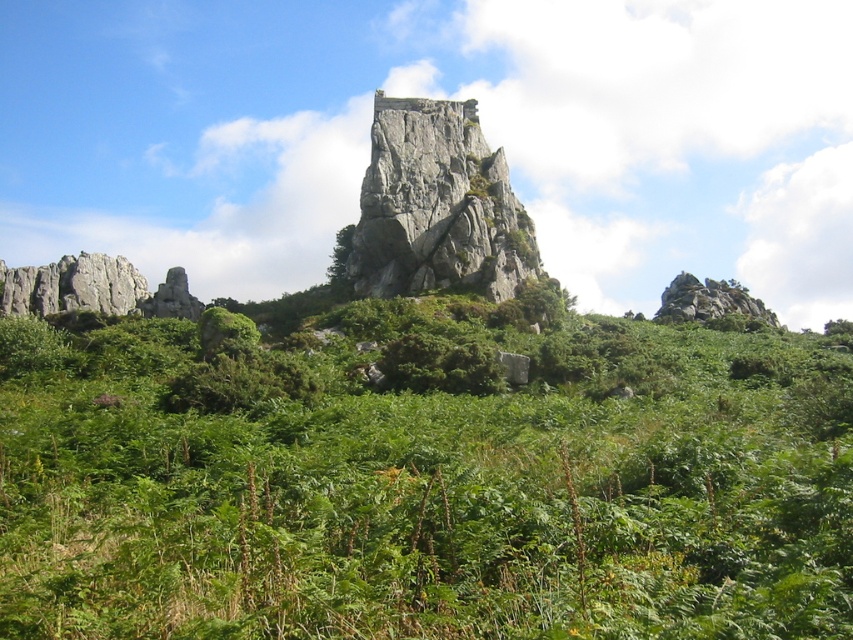
You are standing in the rugged landscape looking at the rock formation. There are two points marked on the ground. One is at coordinate point(512, 451) and the other at point(343, 273). Which point is closer to you?

Point(512, 451) is closer to you than point(343, 273).

You are a hiker who wants to take a photo of the rugged stone rock at center and the green leafy shrubs at center. Which object should you focus on first if you want to capture both in a single frame without moving the camera?

You should focus on the rugged stone rock at center first because the green leafy shrubs at center are to the left of it, meaning they are closer to the camera. By focusing on the farther object first, you can ensure both are in focus if your depth of field is sufficient.

You are a hiker standing at the base of the rock formation. You notice both the green leafy shrubs at center and the green leafy tree at center. Which one is positioned lower in the scene?

The green leafy shrubs at center are positioned lower than the green leafy tree at center, as they are located below it.